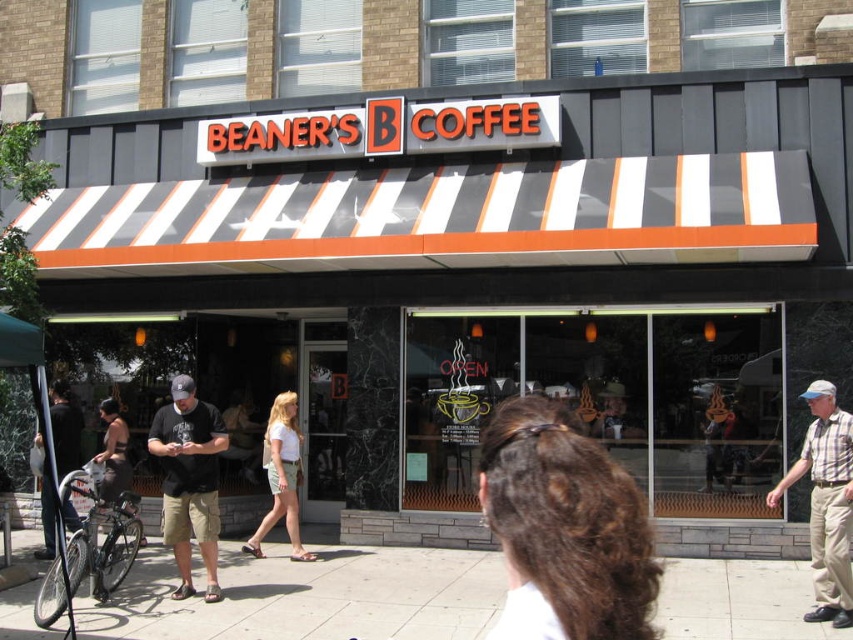
Question: Is gray concrete sidewalk at lower center smaller than white cotton shirt at center?

Choices:
 (A) no
 (B) yes

Answer: (B)

Question: Among these objects, which one is nearest to the camera?

Choices:
 (A) dark gray t-shirt at center
 (B) gray concrete sidewalk at lower center

Answer: (B)

Question: Which object is closer to the camera taking this photo?

Choices:
 (A) white cotton shirt at center
 (B) dark gray shorts at left

Answer: (B)

Question: Is white cotton shirt at center thinner than dark gray shorts at left?

Choices:
 (A) no
 (B) yes

Answer: (B)

Question: Which of the following is the farthest from the observer?

Choices:
 (A) dark gray t-shirt at center
 (B) dark gray shorts at left
 (C) dark brown leather jacket at center
 (D) dark brown hair at center

Answer: (B)

Question: Can you confirm if plaid shirt at right is positioned to the right of white cotton shirt at center?

Choices:
 (A) no
 (B) yes

Answer: (B)